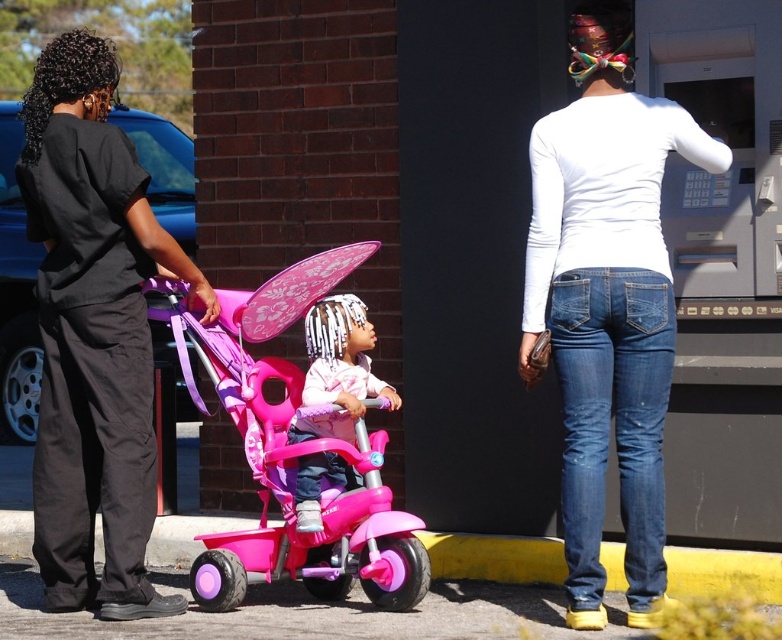
Question: Does black fabric shirt at left have a lesser width compared to matte pink tricycle at center?

Choices:
 (A) no
 (B) yes

Answer: (A)

Question: Can you confirm if black fabric shirt at left is positioned below pink plastic tricycle at center?

Choices:
 (A) no
 (B) yes

Answer: (A)

Question: Which point is farther to the camera?

Choices:
 (A) matte pink tricycle at center
 (B) black fabric shirt at left
 (C) pink plastic tricycle at center

Answer: (A)

Question: Which of the following is the closest to the observer?

Choices:
 (A) (45, 310)
 (B) (339, 262)
 (C) (379, 381)

Answer: (A)

Question: Does pink plastic tricycle at center have a smaller size compared to matte pink tricycle at center?

Choices:
 (A) yes
 (B) no

Answer: (B)

Question: Which point is farther from the camera taking this photo?

Choices:
 (A) (316, 422)
 (B) (178, 298)
 (C) (51, 355)

Answer: (C)